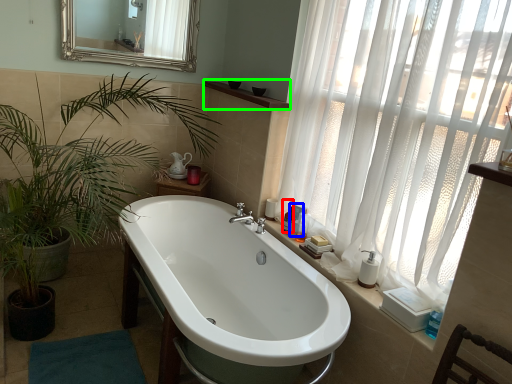
Question: Which object is positioned closest to toiletry (highlighted by a red box)? Select from toiletry (highlighted by a blue box) and balustrade (highlighted by a green box).

Choices:
 (A) toiletry
 (B) balustrade

Answer: (A)